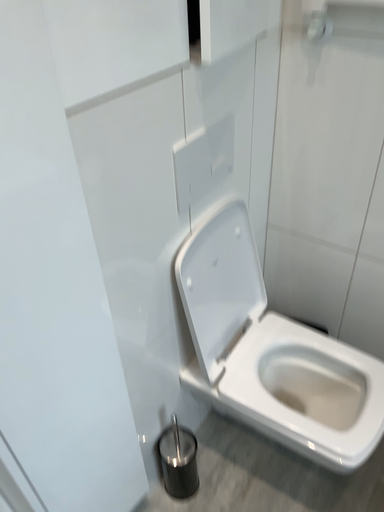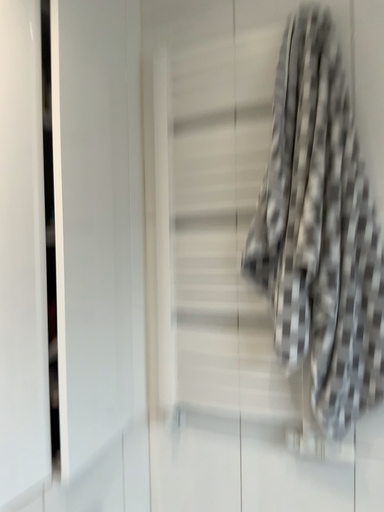
Question: Which way did the camera rotate in the video?

Choices:
 (A) rotated downward
 (B) rotated upward

Answer: (B)